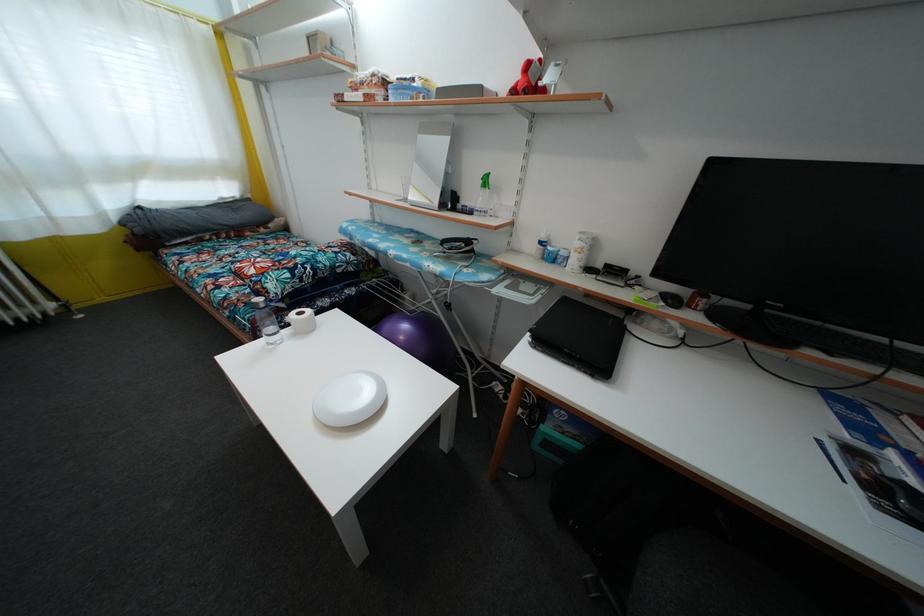
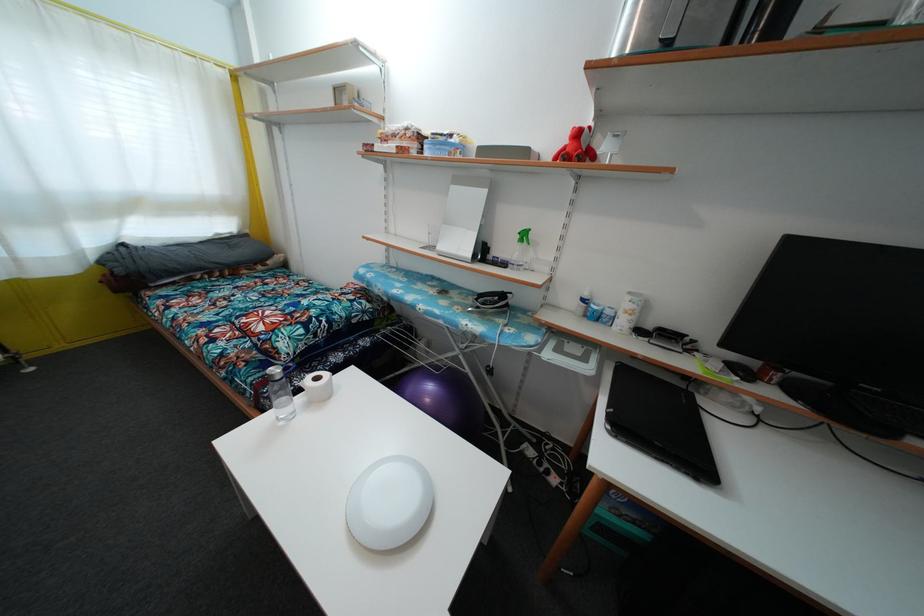
In a continuous first-person perspective shot, in which direction is the camera moving?

The movement direction of the cameraman is left, forward.